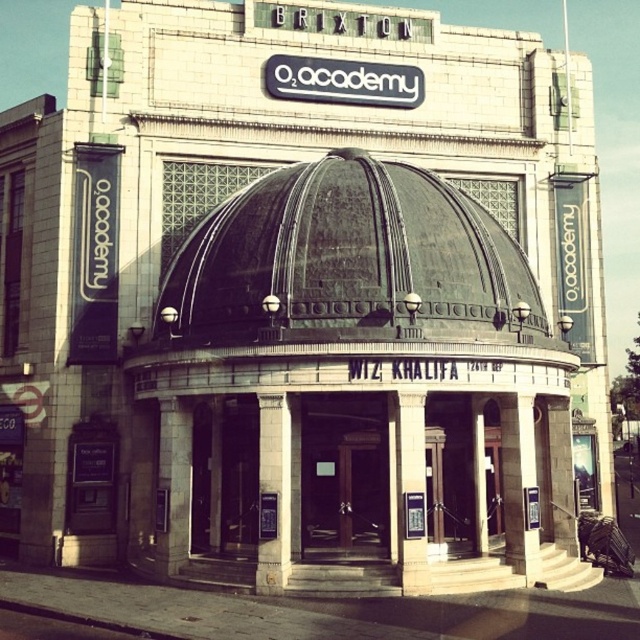
Who is higher up, bronze textured dome at center or white stone pillar at center?

Positioned higher is bronze textured dome at center.

You are a GUI agent. You are given a task and a screenshot of the screen. Output one action in this format:
    pyautogui.click(x=<x>, y=<y>)
    Task: Click on the bronze textured dome at center
    The image size is (640, 640).
    Given the screenshot: What is the action you would take?
    pyautogui.click(x=346, y=257)

Where is `bronze textured dome at center`? Image resolution: width=640 pixels, height=640 pixels. bronze textured dome at center is located at coordinates [x=346, y=257].

Is bronze textured dome at center behind wooden door at center?

No.

Consider the image. Who is shorter, bronze textured dome at center or wooden door at center?

With less height is wooden door at center.

Image resolution: width=640 pixels, height=640 pixels. What do you see at coordinates (346, 257) in the screenshot?
I see `bronze textured dome at center` at bounding box center [346, 257].

Where is `bronze textured dome at center`? The width and height of the screenshot is (640, 640). bronze textured dome at center is located at coordinates (346, 257).

Can you confirm if wooden door at center is bigger than white stone pillar at center?

Indeed, wooden door at center has a larger size compared to white stone pillar at center.

Consider the image. Which is more to the left, wooden door at center or white stone pillar at center?

Positioned to the left is wooden door at center.

Identify the location of wooden door at center. This screenshot has height=640, width=640. (344, 474).

The image size is (640, 640). In order to click on wooden door at center in this screenshot , I will do `click(344, 474)`.